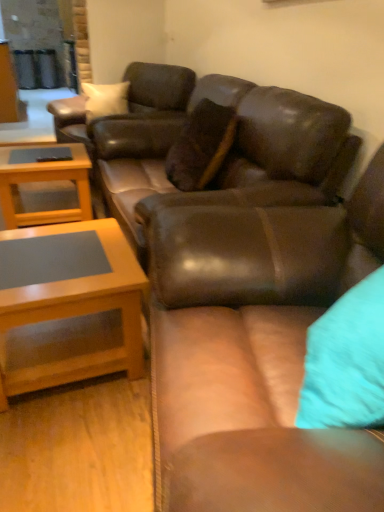
You are a GUI agent. You are given a task and a screenshot of the screen. Output one action in this format:
    pyautogui.click(x=<x>, y=<y>)
    Task: Click on the leather couch at center, placed as the second studio couch when sorted from back to front
    This screenshot has width=384, height=512.
    Given the screenshot: What is the action you would take?
    (255, 353)

How much space does light brown wood coffee table at lower left, the 1th coffee table positioned from the bottom, occupy vertically?

The height of light brown wood coffee table at lower left, the 1th coffee table positioned from the bottom, is 18.66 inches.

At what (x,y) coordinates should I click in order to perform the action: click on light brown wood coffee table at lower left, the 1th coffee table positioned from the bottom. Please return your answer as a coordinate pair (x, y). The image size is (384, 512). Looking at the image, I should click on (71, 313).

The height and width of the screenshot is (512, 384). I want to click on matte brown leather couch at center, which is the 1th studio couch from back to front, so click(x=228, y=155).

Considering the sizes of objects light brown wood coffee table at lower left, the 1th coffee table positioned from the bottom, and matte brown leather couch at center, which is the 1th studio couch from back to front, in the image provided, who is shorter, light brown wood coffee table at lower left, the 1th coffee table positioned from the bottom, or matte brown leather couch at center, which is the 1th studio couch from back to front,?

light brown wood coffee table at lower left, the 1th coffee table positioned from the bottom, is shorter.

Is there a large distance between light brown wood coffee table at lower left, the first coffee table positioned from the front, and matte brown leather couch at center, the 2th studio couch from the front?

light brown wood coffee table at lower left, the first coffee table positioned from the front, is actually quite close to matte brown leather couch at center, the 2th studio couch from the front.

Is light brown wood coffee table at lower left, the first coffee table positioned from the front, looking in the opposite direction of matte brown leather couch at center, the 2th studio couch from the front?

Yes, light brown wood coffee table at lower left, the first coffee table positioned from the front,'s orientation is away from matte brown leather couch at center, the 2th studio couch from the front.

From the picture: Which object is closer to the camera taking this photo, light brown wood coffee table at lower left, acting as the second coffee table starting from the back, or matte brown leather couch at center, which is the 1th studio couch from back to front?

light brown wood coffee table at lower left, acting as the second coffee table starting from the back, is closer to the camera.

Can you confirm if light brown wood coffee table at left, marked as the second coffee table in a front-to-back arrangement, is shorter than leather couch at center, placed as the second studio couch when sorted from back to front?

Yes, light brown wood coffee table at left, marked as the second coffee table in a front-to-back arrangement, is shorter than leather couch at center, placed as the second studio couch when sorted from back to front.

Which point is more forward, (17, 209) or (296, 220)?

Point (296, 220)

How many degrees apart are the facing directions of light brown wood coffee table at left, arranged as the 2th coffee table when ordered from the bottom, and leather couch at center, marked as the 1th studio couch in a front-to-back arrangement?

There is a 10.6-degree angle between the facing directions of light brown wood coffee table at left, arranged as the 2th coffee table when ordered from the bottom, and leather couch at center, marked as the 1th studio couch in a front-to-back arrangement.

Is light brown wood coffee table at left, arranged as the 2th coffee table when ordered from the bottom, inside or outside of leather couch at center, marked as the 1th studio couch in a front-to-back arrangement?

light brown wood coffee table at left, arranged as the 2th coffee table when ordered from the bottom, is spatially situated outside leather couch at center, marked as the 1th studio couch in a front-to-back arrangement.

From the image's perspective, is leather couch at center, marked as the 1th studio couch in a front-to-back arrangement, over brown leather swivel chair at center?

No, from the image's perspective, leather couch at center, marked as the 1th studio couch in a front-to-back arrangement, is not above brown leather swivel chair at center.

From a real-world perspective, is leather couch at center, marked as the 1th studio couch in a front-to-back arrangement, under brown leather swivel chair at center?

Yes, from a real-world perspective, leather couch at center, marked as the 1th studio couch in a front-to-back arrangement, is beneath brown leather swivel chair at center.

How different are the orientations of leather couch at center, placed as the second studio couch when sorted from back to front, and brown leather swivel chair at center in degrees?

There is a 28.2-degree angle between the facing directions of leather couch at center, placed as the second studio couch when sorted from back to front, and brown leather swivel chair at center.

Is leather couch at center, marked as the 1th studio couch in a front-to-back arrangement, not near brown leather swivel chair at center?

That's right, there is a large distance between leather couch at center, marked as the 1th studio couch in a front-to-back arrangement, and brown leather swivel chair at center.

Which object is positioned more to the left, light brown wood coffee table at lower left, the first coffee table positioned from the front, or leather couch at center, marked as the 1th studio couch in a front-to-back arrangement?

From the viewer's perspective, light brown wood coffee table at lower left, the first coffee table positioned from the front, appears more on the left side.

Is light brown wood coffee table at lower left, the 1th coffee table positioned from the bottom, with leather couch at center, marked as the 1th studio couch in a front-to-back arrangement?

light brown wood coffee table at lower left, the 1th coffee table positioned from the bottom, and leather couch at center, marked as the 1th studio couch in a front-to-back arrangement, are not in contact.

Based on the photo, from a real-world perspective, between light brown wood coffee table at lower left, the 2th coffee table when ordered from top to bottom, and leather couch at center, marked as the 1th studio couch in a front-to-back arrangement, who is vertically lower?

From a 3D spatial view, light brown wood coffee table at lower left, the 2th coffee table when ordered from top to bottom, is below.

Is light brown wood coffee table at lower left, the 2th coffee table when ordered from top to bottom, smaller than leather couch at center, placed as the second studio couch when sorted from back to front?

Indeed, light brown wood coffee table at lower left, the 2th coffee table when ordered from top to bottom, has a smaller size compared to leather couch at center, placed as the second studio couch when sorted from back to front.

Consider the image. Measure the distance from brown leather swivel chair at center to light brown wood coffee table at lower left, the first coffee table positioned from the front.

brown leather swivel chair at center is 1.49 meters from light brown wood coffee table at lower left, the first coffee table positioned from the front.

Is light brown wood coffee table at lower left, the first coffee table positioned from the front, located within brown leather swivel chair at center?

Definitely not — light brown wood coffee table at lower left, the first coffee table positioned from the front, is not inside brown leather swivel chair at center.

Is brown leather swivel chair at center positioned with its back to light brown wood coffee table at lower left, the 2th coffee table when ordered from top to bottom?

No, light brown wood coffee table at lower left, the 2th coffee table when ordered from top to bottom, is not at the back of brown leather swivel chair at center.

Who is shorter, brown leather swivel chair at center or light brown wood coffee table at lower left, acting as the second coffee table starting from the back?

light brown wood coffee table at lower left, acting as the second coffee table starting from the back.

Considering the relative sizes of light brown wood coffee table at left, arranged as the 2th coffee table when ordered from the bottom, and light brown wood coffee table at lower left, the 2th coffee table when ordered from top to bottom, in the image provided, is light brown wood coffee table at left, arranged as the 2th coffee table when ordered from the bottom, bigger than light brown wood coffee table at lower left, the 2th coffee table when ordered from top to bottom,?

Indeed, light brown wood coffee table at left, arranged as the 2th coffee table when ordered from the bottom, has a larger size compared to light brown wood coffee table at lower left, the 2th coffee table when ordered from top to bottom.

From the image's perspective, between light brown wood coffee table at left, marked as the second coffee table in a front-to-back arrangement, and light brown wood coffee table at lower left, the first coffee table positioned from the front, which one is located above?

light brown wood coffee table at left, marked as the second coffee table in a front-to-back arrangement, appears higher in the image.

What's the angular difference between light brown wood coffee table at left, marked as the second coffee table in a front-to-back arrangement, and light brown wood coffee table at lower left, the 1th coffee table positioned from the bottom,'s facing directions?

light brown wood coffee table at left, marked as the second coffee table in a front-to-back arrangement, and light brown wood coffee table at lower left, the 1th coffee table positioned from the bottom, are facing 3.33 degrees away from each other.

Which of these two, light brown wood coffee table at left, marked as the second coffee table in a front-to-back arrangement, or light brown wood coffee table at lower left, the 1th coffee table positioned from the bottom, is wider?

With larger width is light brown wood coffee table at left, marked as the second coffee table in a front-to-back arrangement.

Starting from the brown leather swivel chair at center, which coffee table is the 1st one in front? Please provide its 2D coordinates.

[(45, 182)]

From a real-world perspective, between brown leather swivel chair at center and light brown wood coffee table at left, placed as the 1th coffee table when sorted from top to bottom, who is vertically higher?

brown leather swivel chair at center is physically above.

From the image's perspective, which is above, brown leather swivel chair at center or light brown wood coffee table at left, marked as the second coffee table in a front-to-back arrangement?

From the image's view, brown leather swivel chair at center is above.

Locate an element on the screen. This screenshot has height=512, width=384. studio couch located above the light brown wood coffee table at lower left, the first coffee table positioned from the front (from the image's perspective) is located at coordinates (228, 155).

Where is `the 2nd coffee table below the leather couch at center, marked as the 1th studio couch in a front-to-back arrangement (from a real-world perspective)`? Image resolution: width=384 pixels, height=512 pixels. the 2nd coffee table below the leather couch at center, marked as the 1th studio couch in a front-to-back arrangement (from a real-world perspective) is located at coordinates (45, 182).

Based on the photo, from the image, which object appears to be farther from matte brown leather couch at center, the 2th studio couch from the front, light brown wood coffee table at lower left, the 1th coffee table positioned from the bottom, or light brown wood coffee table at left, marked as the second coffee table in a front-to-back arrangement?

The object further to matte brown leather couch at center, the 2th studio couch from the front, is light brown wood coffee table at left, marked as the second coffee table in a front-to-back arrangement.

Considering their positions, is light brown wood coffee table at lower left, the 2th coffee table when ordered from top to bottom, positioned closer to light brown wood coffee table at left, arranged as the 2th coffee table when ordered from the bottom, than brown leather swivel chair at center?

brown leather swivel chair at center is closer to light brown wood coffee table at left, arranged as the 2th coffee table when ordered from the bottom.

Estimate the real-world distances between objects in this image. Which object is closer to light brown wood coffee table at lower left, the 2th coffee table when ordered from top to bottom, brown leather swivel chair at center or light brown wood coffee table at left, marked as the second coffee table in a front-to-back arrangement?

light brown wood coffee table at left, marked as the second coffee table in a front-to-back arrangement, is closer to light brown wood coffee table at lower left, the 2th coffee table when ordered from top to bottom.

Considering their positions, is leather couch at center, marked as the 1th studio couch in a front-to-back arrangement, positioned further to light brown wood coffee table at left, placed as the 1th coffee table when sorted from top to bottom, than matte brown leather couch at center, the 2th studio couch from the front?

Based on the image, leather couch at center, marked as the 1th studio couch in a front-to-back arrangement, appears to be further to light brown wood coffee table at left, placed as the 1th coffee table when sorted from top to bottom.

From the image, which object appears to be nearer to light brown wood coffee table at left, placed as the first coffee table when sorted from back to front, matte brown leather couch at center, the 2th studio couch from the front, or leather couch at center, placed as the second studio couch when sorted from back to front?

The object closer to light brown wood coffee table at left, placed as the first coffee table when sorted from back to front, is matte brown leather couch at center, the 2th studio couch from the front.

From the image, which object appears to be nearer to brown leather swivel chair at center, light brown wood coffee table at lower left, the first coffee table positioned from the front, or leather couch at center, marked as the 1th studio couch in a front-to-back arrangement?

light brown wood coffee table at lower left, the first coffee table positioned from the front.

When comparing their distances from brown leather swivel chair at center, does light brown wood coffee table at left, arranged as the 2th coffee table when ordered from the bottom, or leather couch at center, placed as the second studio couch when sorted from back to front, seem further?

The object further to brown leather swivel chair at center is leather couch at center, placed as the second studio couch when sorted from back to front.

Considering their positions, is light brown wood coffee table at left, arranged as the 2th coffee table when ordered from the bottom, positioned further to brown leather swivel chair at center than light brown wood coffee table at lower left, acting as the second coffee table starting from the back?

light brown wood coffee table at lower left, acting as the second coffee table starting from the back.

Locate an element on the screen. The image size is (384, 512). coffee table located between matte brown leather couch at center, which is the 1th studio couch from back to front, and brown leather swivel chair at center in the depth direction is located at coordinates (45, 182).

Find the location of `coffee table between light brown wood coffee table at lower left, the first coffee table positioned from the front, and brown leather swivel chair at center in the front-back direction`. coffee table between light brown wood coffee table at lower left, the first coffee table positioned from the front, and brown leather swivel chair at center in the front-back direction is located at coordinates (45, 182).

Locate an element on the screen. The image size is (384, 512). studio couch between leather couch at center, marked as the 1th studio couch in a front-to-back arrangement, and light brown wood coffee table at left, marked as the second coffee table in a front-to-back arrangement, along the z-axis is located at coordinates [x=228, y=155].

Identify the location of coffee table between leather couch at center, placed as the second studio couch when sorted from back to front, and matte brown leather couch at center, the 2th studio couch from the front, from front to back. [x=71, y=313].